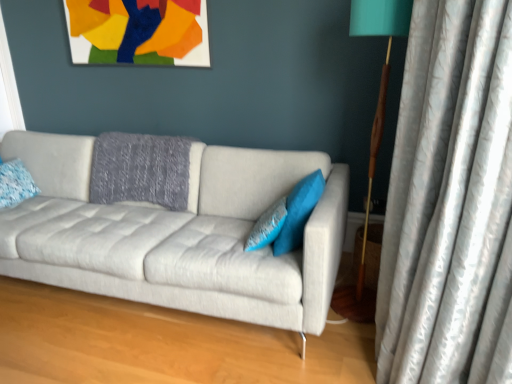
Question: Considering the positions of teal fabric pillow at center, which is the 1th pillow from right to left, and blue textured pillow at left, the first pillow in the left-to-right sequence, in the image, is teal fabric pillow at center, which is the 1th pillow from right to left, taller or shorter than blue textured pillow at left, the first pillow in the left-to-right sequence,?

Choices:
 (A) tall
 (B) short

Answer: (A)

Question: In the image, is teal fabric pillow at center, the third pillow from the left, positioned in front of or behind blue textured pillow at left, the first pillow in the left-to-right sequence?

Choices:
 (A) behind
 (B) front

Answer: (B)

Question: Which of these objects is positioned closest to the teal fabric pillow at center, which is the 1th pillow from right to left?

Choices:
 (A) matte paper picture frame at upper center
 (B) blue textured pillow at center, the 2th pillow from the left
 (C) blue textured pillow at left, which is the 3th pillow from right to left
 (D) silvery textured curtain at right
 (E) teal fabric lampshade at right

Answer: (B)

Question: Considering the real-world distances, which object is farthest from the teal fabric lampshade at right?

Choices:
 (A) teal fabric pillow at center, which is the 1th pillow from right to left
 (B) light gray fabric couch at center
 (C) blue textured pillow at left, the first pillow in the left-to-right sequence
 (D) blue textured pillow at center, the second pillow positioned from the right
 (E) matte paper picture frame at upper center

Answer: (C)